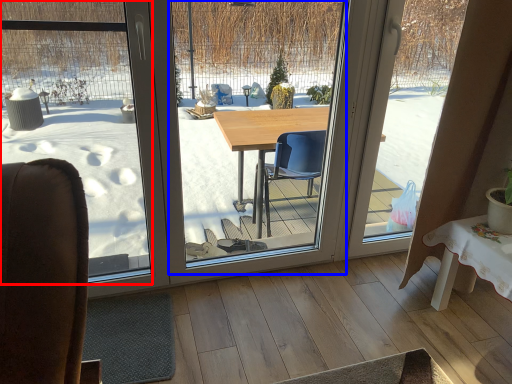
Question: Among these objects, which one is nearest to the camera, window screen (highlighted by a red box) or window screen (highlighted by a blue box)?

Choices:
 (A) window screen
 (B) window screen

Answer: (A)